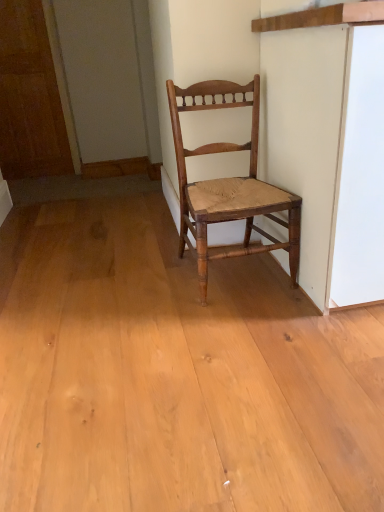
Locate an element on the screen. The image size is (384, 512). natural wood chair at center is located at coordinates (228, 184).

In the scene shown: Measure the distance between point [206,274] and camera.

They are 5.02 feet apart.

The height and width of the screenshot is (512, 384). What do you see at coordinates (228, 184) in the screenshot?
I see `natural wood chair at center` at bounding box center [228, 184].

I want to click on wooden door at left, so click(x=29, y=96).

What do you see at coordinates (29, 96) in the screenshot? The height and width of the screenshot is (512, 384). I see `wooden door at left` at bounding box center [29, 96].

Find the location of a particular element. The width and height of the screenshot is (384, 512). natural wood chair at center is located at coordinates (228, 184).

Which object is positioned more to the left, natural wood chair at center or wooden door at left?

wooden door at left is more to the left.

In the scene shown: Which is behind, natural wood chair at center or wooden door at left?

wooden door at left is more distant.

Considering the positions of points (235, 88) and (16, 48), is point (235, 88) closer to camera compared to point (16, 48)?

Yes, it is.

From the image's perspective, which one is positioned higher, natural wood chair at center or wooden door at left?

From the image's view, wooden door at left is above.

From a real-world perspective, is natural wood chair at center physically located above or below wooden door at left?

Clearly, from a real-world perspective, natural wood chair at center is below wooden door at left.

Considering the sizes of objects natural wood chair at center and wooden door at left in the image provided, who is wider, natural wood chair at center or wooden door at left?

Wider between the two is natural wood chair at center.

Which of these two, natural wood chair at center or wooden door at left, stands taller?

With more height is wooden door at left.

Who is smaller, natural wood chair at center or wooden door at left?

wooden door at left is smaller.

Is natural wood chair at center situated inside wooden door at left or outside?

natural wood chair at center is not enclosed by wooden door at left.

From the picture: Is natural wood chair at center far from wooden door at left?

Yes.

Is natural wood chair at center facing away from wooden door at left?

natural wood chair at center is not turned away from wooden door at left.

Consider the image. How different are the orientations of natural wood chair at center and wooden door at left in degrees?

There is a 0.347-degree angle between the facing directions of natural wood chair at center and wooden door at left.

Find the location of a particular element. chair on the right of wooden door at left is located at coordinates (228, 184).

Consider the image. Between wooden door at left and natural wood chair at center, which one appears on the left side from the viewer's perspective?

wooden door at left is more to the left.

In the image, is wooden door at left positioned in front of or behind natural wood chair at center?

wooden door at left is behind natural wood chair at center.

Is point (28, 160) closer or farther from the camera than point (273, 210)?

Point (28, 160) is farther from the camera than point (273, 210).

From the image's perspective, is wooden door at left above or below natural wood chair at center?

wooden door at left is situated higher than natural wood chair at center in the image.

From a real-world perspective, is wooden door at left positioned under natural wood chair at center based on gravity?

No, from a real-world perspective, wooden door at left is not beneath natural wood chair at center.

Can you confirm if wooden door at left is thinner than natural wood chair at center?

Yes, wooden door at left is thinner than natural wood chair at center.

Who is taller, wooden door at left or natural wood chair at center?

With more height is wooden door at left.

Who is smaller, wooden door at left or natural wood chair at center?

wooden door at left is smaller.

Which is correct: wooden door at left is inside natural wood chair at center, or outside of it?

wooden door at left is outside natural wood chair at center.

Is wooden door at left directly adjacent to natural wood chair at center?

No, wooden door at left is not in contact with natural wood chair at center.

Is wooden door at left positioned with its back to natural wood chair at center?

No, wooden door at left's orientation is not away from natural wood chair at center.

Measure the distance from wooden door at left to natural wood chair at center.

wooden door at left is 2.40 meters from natural wood chair at center.

Image resolution: width=384 pixels, height=512 pixels. I want to click on chair to the right of wooden door at left, so click(228, 184).

The width and height of the screenshot is (384, 512). I want to click on chair that is in front of the wooden door at left, so click(228, 184).

At what (x,y) coordinates should I click in order to perform the action: click on chair located below the wooden door at left (from the image's perspective). Please return your answer as a coordinate pair (x, y). The width and height of the screenshot is (384, 512). Looking at the image, I should click on (228, 184).